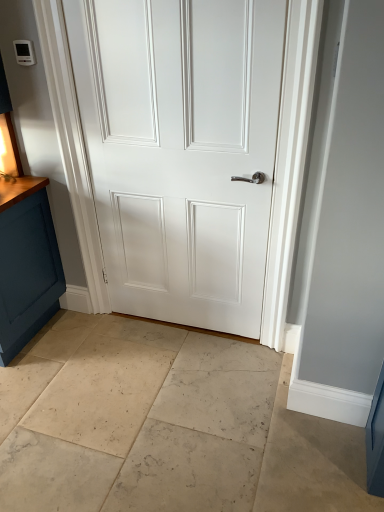
Find the location of a particular element. vacant space in front of white matte door at center is located at coordinates (178, 392).